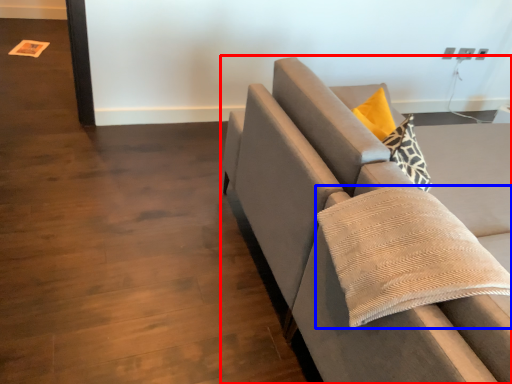
Question: Which object is further to the camera taking this photo, studio couch (highlighted by a red box) or pillow (highlighted by a blue box)?

Choices:
 (A) studio couch
 (B) pillow

Answer: (A)